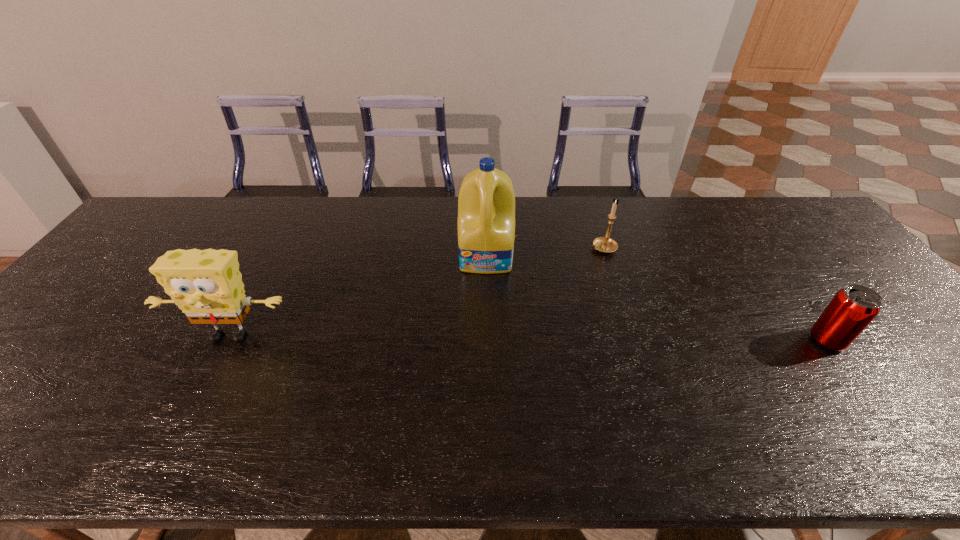
Find the location of `the second tallest object`. the second tallest object is located at coordinates (207, 286).

The width and height of the screenshot is (960, 540). I want to click on the leftmost object, so click(x=207, y=286).

This screenshot has width=960, height=540. I want to click on soda can, so click(x=852, y=309).

The width and height of the screenshot is (960, 540). I want to click on the tallest object, so click(x=486, y=204).

Identify the location of detergent. (486, 204).

Identify the location of the second object from right to left. (605, 244).

Where is `free point located on the face of the third shortest object`? The height and width of the screenshot is (540, 960). free point located on the face of the third shortest object is located at coordinates (196, 402).

Find the location of a particular element. This screenshot has height=540, width=960. blank area located on the back of the soda can is located at coordinates (779, 274).

What are the coordinates of `free location located on the label of the tallest object` in the screenshot? It's located at (486, 295).

This screenshot has width=960, height=540. I want to click on blank space located 0.080m on the label of the tallest object, so click(486, 295).